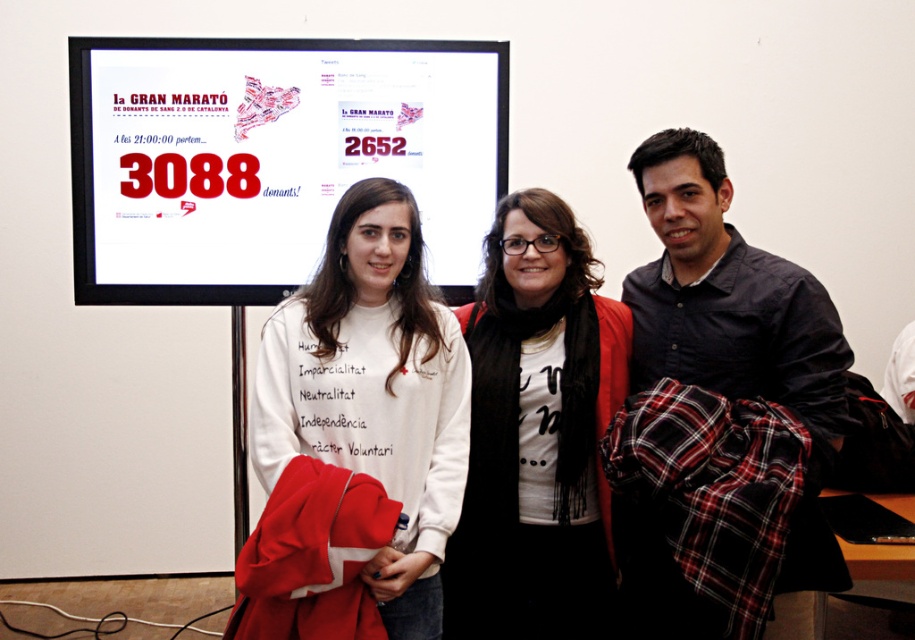
Question: Which of the following is the farthest from the observer?

Choices:
 (A) (454, 140)
 (B) (447, 465)

Answer: (A)

Question: Considering the real-world distances, which object is farthest from the white matte t-shirt at center?

Choices:
 (A) white cotton sweatshirt at center
 (B) matte white poster at upper center
 (C) dark blue shirt at center

Answer: (B)

Question: Is matte white poster at upper center bigger than white cotton sweatshirt at center?

Choices:
 (A) yes
 (B) no

Answer: (B)

Question: Is white cotton sweatshirt at center closer to the viewer compared to dark blue shirt at center?

Choices:
 (A) yes
 (B) no

Answer: (A)

Question: Where is white cotton sweatshirt at center located in relation to dark blue shirt at center in the image?

Choices:
 (A) above
 (B) below

Answer: (B)

Question: Which of the following is the farthest from the observer?

Choices:
 (A) (553, 195)
 (B) (337, 65)
 (C) (811, 376)
 (D) (393, 637)

Answer: (B)